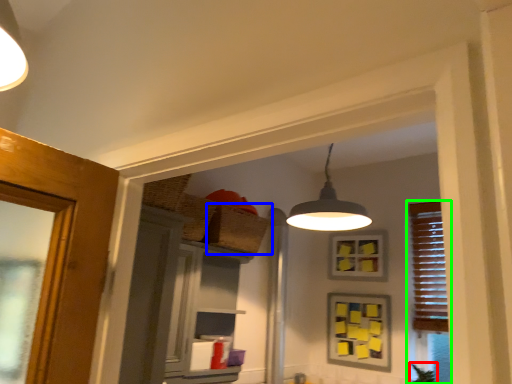
Question: Which object is positioned farthest from plant (highlighted by a red box)? Select from basket (highlighted by a blue box) and window (highlighted by a green box).

Choices:
 (A) basket
 (B) window

Answer: (A)